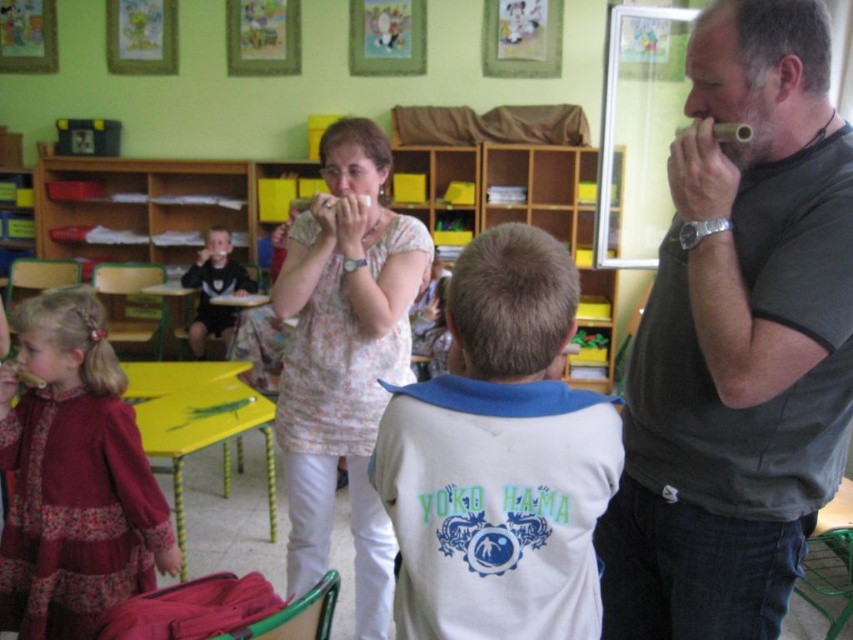
Is dark gray t-shirt at right below floral fabric blouse at center?

No, dark gray t-shirt at right is not below floral fabric blouse at center.

In the scene shown: Which is above, dark gray t-shirt at right or floral fabric blouse at center?

dark gray t-shirt at right is higher up.

Does point (821, 445) come farther from viewer compared to point (341, 344)?

No, (821, 445) is in front of (341, 344).

Locate an element on the screen. The height and width of the screenshot is (640, 853). dark gray t-shirt at right is located at coordinates (738, 340).

Who is higher up, dark gray t-shirt at right or black matte shirt at left?

Positioned higher is black matte shirt at left.

Does dark gray t-shirt at right appear over black matte shirt at left?

Result: No.

At what (x,y) coordinates should I click in order to perform the action: click on dark gray t-shirt at right. Please return your answer as a coordinate pair (x, y). This screenshot has width=853, height=640. Looking at the image, I should click on (738, 340).

The width and height of the screenshot is (853, 640). I want to click on dark gray t-shirt at right, so click(x=738, y=340).

Describe the element at coordinates (738, 340) in the screenshot. I see `dark gray t-shirt at right` at that location.

How much distance is there between dark gray t-shirt at right and white cotton shirt at center?

They are 13.46 inches apart.

Which is behind, point (718, 552) or point (548, 362)?

The point (718, 552) is more distant.

Find the location of a particular element. dark gray t-shirt at right is located at coordinates (738, 340).